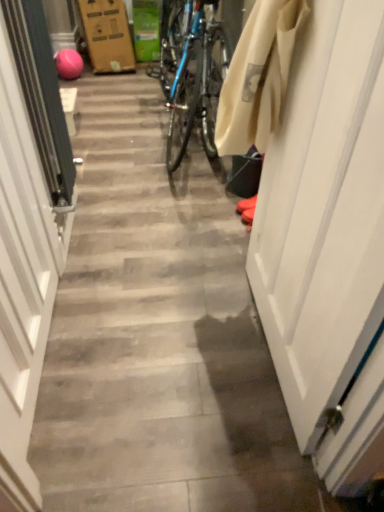
Question: Based on their sizes in the image, would you say white glossy door at left, the 1th door when ordered from left to right, is bigger or smaller than white matte door at right, the 1th door from the right?

Choices:
 (A) small
 (B) big

Answer: (B)

Question: From a real-world perspective, is white glossy door at left, the 1th door when ordered from left to right, above or below white matte door at right, the 1th door from the right?

Choices:
 (A) below
 (B) above

Answer: (A)

Question: Is white glossy door at left, placed as the second door when sorted from right to left, in front of or behind white matte door at right, which ranks as the 2th door in left-to-right order, in the image?

Choices:
 (A) behind
 (B) front

Answer: (A)

Question: From the image's perspective, is white matte door at right, the 1th door from the right, above or below white glossy door at left, the 1th door when ordered from left to right?

Choices:
 (A) above
 (B) below

Answer: (A)

Question: Considering the positions of white matte door at right, which ranks as the 2th door in left-to-right order, and white glossy door at left, the 1th door when ordered from left to right, in the image, is white matte door at right, which ranks as the 2th door in left-to-right order, bigger or smaller than white glossy door at left, the 1th door when ordered from left to right,?

Choices:
 (A) big
 (B) small

Answer: (B)

Question: From their relative heights in the image, would you say white matte door at right, which ranks as the 2th door in left-to-right order, is taller or shorter than white glossy door at left, placed as the second door when sorted from right to left?

Choices:
 (A) short
 (B) tall

Answer: (B)

Question: Visually, is white matte door at right, the 1th door from the right, positioned to the left or to the right of white glossy door at left, placed as the second door when sorted from right to left?

Choices:
 (A) right
 (B) left

Answer: (A)